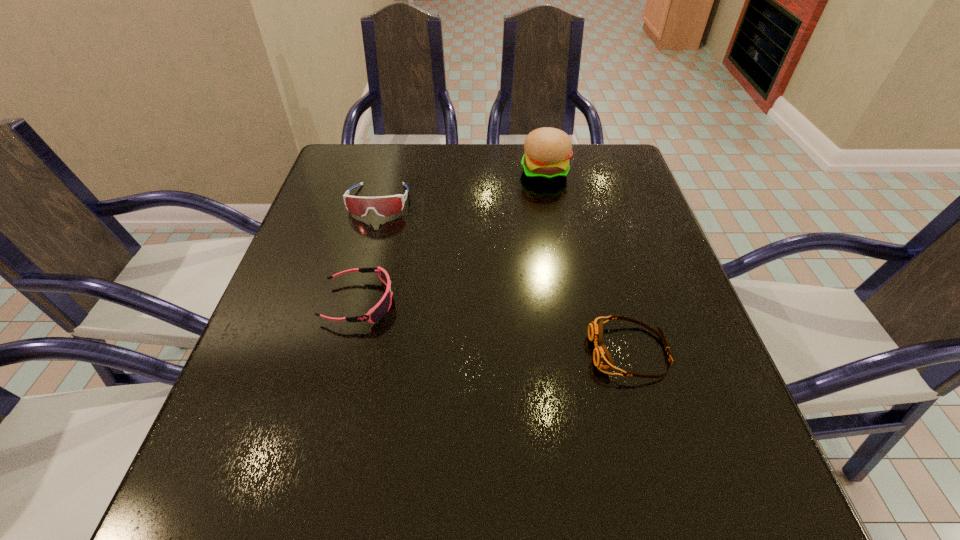
Locate an element on the screen. Image resolution: width=960 pixels, height=540 pixels. the tallest object is located at coordinates (547, 150).

Where is `the second tallest object`? The width and height of the screenshot is (960, 540). the second tallest object is located at coordinates (384, 206).

Find the location of a particular element. the tallest goggles is located at coordinates (384, 206).

Where is `the rightmost goggles`? the rightmost goggles is located at coordinates (602, 359).

This screenshot has width=960, height=540. Find the location of `vacant area situated 0.120m on the right of the hamburger`. vacant area situated 0.120m on the right of the hamburger is located at coordinates (614, 172).

I want to click on free space located on the front-facing side of the tallest goggles, so click(x=356, y=285).

At what (x,y) coordinates should I click in order to perform the action: click on vacant point located with the lenses facing forward on the rightmost goggles. Please return your answer as a coordinate pair (x, y). Looking at the image, I should click on (414, 352).

The height and width of the screenshot is (540, 960). I want to click on vacant area located 0.350m with the lenses facing forward on the rightmost goggles, so click(x=391, y=352).

This screenshot has height=540, width=960. In order to click on blank space located with the lenses facing forward on the rightmost goggles in this screenshot , I will do `click(414, 352)`.

You are a GUI agent. You are given a task and a screenshot of the screen. Output one action in this format:
    pyautogui.click(x=<x>, y=<y>)
    Task: Click on the hamburger that is at the far edge
    The image size is (960, 540).
    Given the screenshot: What is the action you would take?
    pyautogui.click(x=547, y=150)